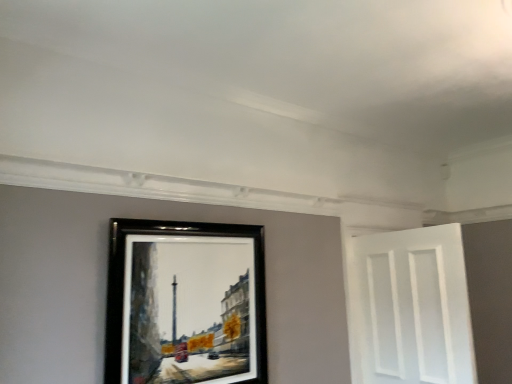
What are the coordinates of `white matte door at right` in the screenshot? It's located at (410, 308).

What do you see at coordinates (410, 308) in the screenshot? Image resolution: width=512 pixels, height=384 pixels. I see `white matte door at right` at bounding box center [410, 308].

Identify the location of black wooden picture frame at upper center. Image resolution: width=512 pixels, height=384 pixels. (185, 303).

What is the approximate width of black wooden picture frame at upper center?

black wooden picture frame at upper center is 8.64 centimeters in width.

What do you see at coordinates (185, 303) in the screenshot? I see `black wooden picture frame at upper center` at bounding box center [185, 303].

Find the location of `white matte door at right`. white matte door at right is located at coordinates (410, 308).

Would you say black wooden picture frame at upper center is to the left or to the right of white matte door at right in the picture?

Clearly, black wooden picture frame at upper center is on the left of white matte door at right in the image.

Is the position of black wooden picture frame at upper center less distant than that of white matte door at right?

That is True.

Is point (202, 290) positioned after point (402, 295)?

No, it is not.

From the picture: From the image's perspective, between black wooden picture frame at upper center and white matte door at right, who is located below?

white matte door at right, from the image's perspective.

From a real-world perspective, which is physically above, black wooden picture frame at upper center or white matte door at right?

black wooden picture frame at upper center is physically above.

Considering the sizes of objects black wooden picture frame at upper center and white matte door at right in the image provided, who is thinner, black wooden picture frame at upper center or white matte door at right?

With smaller width is black wooden picture frame at upper center.

Who is shorter, black wooden picture frame at upper center or white matte door at right?

With less height is black wooden picture frame at upper center.

Does black wooden picture frame at upper center have a larger size compared to white matte door at right?

Incorrect, black wooden picture frame at upper center is not larger than white matte door at right.

Could white matte door at right be considered to be inside black wooden picture frame at upper center?

No, white matte door at right is not surrounded by black wooden picture frame at upper center.

Is black wooden picture frame at upper center placed right next to white matte door at right?

There is a gap between black wooden picture frame at upper center and white matte door at right.

Is black wooden picture frame at upper center facing away from white matte door at right?

No.

Can you tell me how much black wooden picture frame at upper center and white matte door at right differ in facing direction?

black wooden picture frame at upper center and white matte door at right are facing 84.5 degrees away from each other.

How far apart are black wooden picture frame at upper center and white matte door at right?

The distance of black wooden picture frame at upper center from white matte door at right is 1.16 meters.

Locate an element on the screen. Image resolution: width=512 pixels, height=384 pixels. picture frame above the white matte door at right (from a real-world perspective) is located at coordinates (185, 303).

Which object is positioned more to the left, white matte door at right or black wooden picture frame at upper center?

Positioned to the left is black wooden picture frame at upper center.

Relative to black wooden picture frame at upper center, is white matte door at right in front or behind?

white matte door at right is positioned farther from the viewer than black wooden picture frame at upper center.

Does point (368, 366) lie behind point (229, 244)?

Yes.

From the image's perspective, is white matte door at right below black wooden picture frame at upper center?

Correct, white matte door at right appears lower than black wooden picture frame at upper center in the image.

From the picture: From a real-world perspective, is white matte door at right below black wooden picture frame at upper center?

Indeed, from a real-world perspective, white matte door at right is positioned beneath black wooden picture frame at upper center.

Between white matte door at right and black wooden picture frame at upper center, which one has larger width?

Wider between the two is white matte door at right.

Which of these two, white matte door at right or black wooden picture frame at upper center, stands shorter?

With less height is black wooden picture frame at upper center.

Considering the relative sizes of white matte door at right and black wooden picture frame at upper center in the image provided, is white matte door at right bigger than black wooden picture frame at upper center?

Yes.

Which is correct: white matte door at right is inside black wooden picture frame at upper center, or outside of it?

white matte door at right is located beyond the bounds of black wooden picture frame at upper center.

Is white matte door at right in contact with black wooden picture frame at upper center?

No, white matte door at right is not with black wooden picture frame at upper center.

Is black wooden picture frame at upper center at the back of white matte door at right?

Yes.

Measure the distance between white matte door at right and black wooden picture frame at upper center.

white matte door at right is 1.16 meters away from black wooden picture frame at upper center.

I want to click on picture frame in front of the white matte door at right, so click(x=185, y=303).

This screenshot has height=384, width=512. What are the coordinates of `door that is below the black wooden picture frame at upper center (from the image's perspective)` in the screenshot? It's located at (410, 308).

The width and height of the screenshot is (512, 384). What are the coordinates of `door directly beneath the black wooden picture frame at upper center (from a real-world perspective)` in the screenshot? It's located at (410, 308).